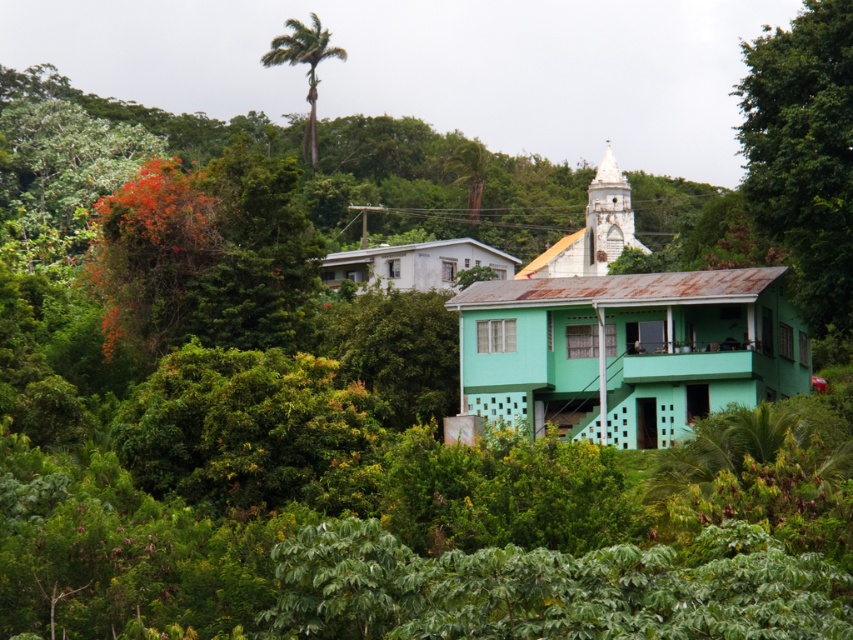
Question: Which point is closer to the camera?

Choices:
 (A) (558, 388)
 (B) (816, 163)

Answer: (B)

Question: Can you confirm if green leafy tree at right is bigger than green leafy palm tree at upper center?

Choices:
 (A) yes
 (B) no

Answer: (A)

Question: Which point is farther to the camera?

Choices:
 (A) white matte church at center
 (B) green leafy palm tree at upper center

Answer: (B)

Question: Is white matte church at center below green leafy tree at right?

Choices:
 (A) no
 (B) yes

Answer: (B)

Question: Is green leafy tree at right above green leafy palm tree at upper center?

Choices:
 (A) yes
 (B) no

Answer: (B)

Question: Estimate the real-world distances between objects in this image. Which object is farther from the green leafy palm tree at upper center?

Choices:
 (A) white matte church at center
 (B) green leafy tree at right

Answer: (B)